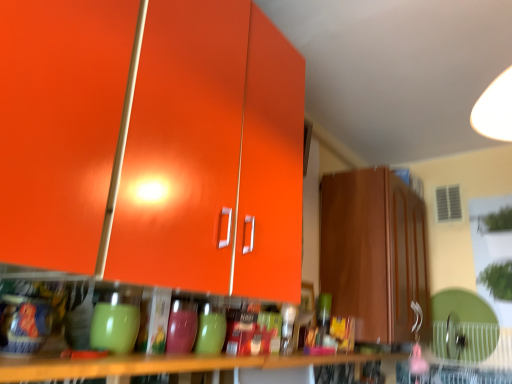
Question: Does glossy orange cabinet at upper left, which is the 1th cabinetry from left to right, have a lesser width compared to wooden table at lower center?

Choices:
 (A) yes
 (B) no

Answer: (B)

Question: Is wooden table at lower center a part of glossy orange cabinet at upper left, the 2th cabinetry viewed from the right?

Choices:
 (A) yes
 (B) no

Answer: (B)

Question: Is glossy orange cabinet at upper left, the 2th cabinetry viewed from the right, beside wooden table at lower center?

Choices:
 (A) no
 (B) yes

Answer: (A)

Question: Is glossy orange cabinet at upper left, arranged as the 1th cabinetry when viewed from the front, smaller than wooden table at lower center?

Choices:
 (A) yes
 (B) no

Answer: (B)

Question: From the image's perspective, is glossy orange cabinet at upper left, which is the 1th cabinetry from left to right, located beneath wooden table at lower center?

Choices:
 (A) no
 (B) yes

Answer: (A)

Question: Is point (403, 200) closer or farther from the camera than point (273, 369)?

Choices:
 (A) farther
 (B) closer

Answer: (A)

Question: From the image's perspective, is matte brown cabinet at right, the 2th cabinetry viewed from the front, located above or below wooden table at lower center?

Choices:
 (A) above
 (B) below

Answer: (A)

Question: Looking at the image, does matte brown cabinet at right, the second cabinetry when ordered from left to right, seem bigger or smaller compared to wooden table at lower center?

Choices:
 (A) big
 (B) small

Answer: (A)

Question: Is matte brown cabinet at right, the first cabinetry viewed from the right, in front of or behind wooden table at lower center in the image?

Choices:
 (A) front
 (B) behind

Answer: (B)

Question: Does point 297,233 appear closer or farther from the camera than point 414,236?

Choices:
 (A) farther
 (B) closer

Answer: (B)

Question: Is glossy orange cabinet at upper left, arranged as the 1th cabinetry when viewed from the front, taller or shorter than matte brown cabinet at right, the 2th cabinetry viewed from the front?

Choices:
 (A) short
 (B) tall

Answer: (B)

Question: Considering their positions, is glossy orange cabinet at upper left, placed as the 2th cabinetry when sorted from back to front, located in front of or behind matte brown cabinet at right, the 1th cabinetry in the back-to-front sequence?

Choices:
 (A) behind
 (B) front

Answer: (B)

Question: Is glossy orange cabinet at upper left, the 2th cabinetry viewed from the right, inside the boundaries of matte brown cabinet at right, the 1th cabinetry in the back-to-front sequence, or outside?

Choices:
 (A) inside
 (B) outside

Answer: (B)

Question: Relative to wooden table at lower center, is glossy orange cabinet at upper left, placed as the 2th cabinetry when sorted from back to front, in front or behind?

Choices:
 (A) behind
 (B) front

Answer: (B)

Question: Considering the positions of glossy orange cabinet at upper left, arranged as the 1th cabinetry when viewed from the front, and wooden table at lower center in the image, is glossy orange cabinet at upper left, arranged as the 1th cabinetry when viewed from the front, bigger or smaller than wooden table at lower center?

Choices:
 (A) small
 (B) big

Answer: (B)